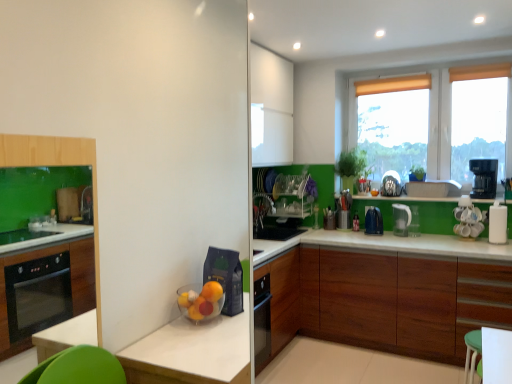
Identify the location of free region on the left part of clear plastic pitcher at upper right, which is the 2th kitchen appliance from left to right. The image size is (512, 384). (390, 238).